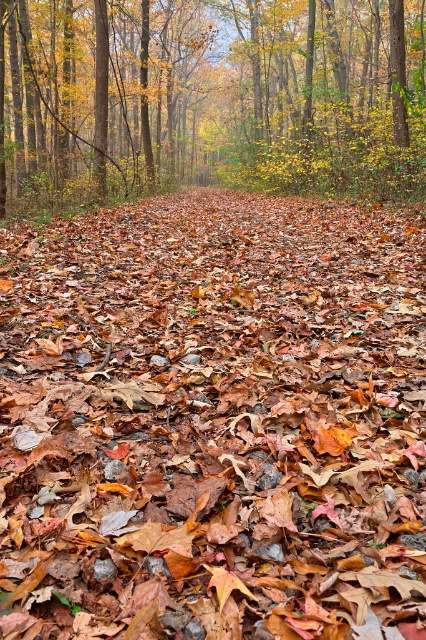
Question: Is the position of brown leaf litter at center less distant than that of yellow-green foliage at center?

Choices:
 (A) no
 (B) yes

Answer: (B)

Question: Can you confirm if brown leaf litter at center is thinner than yellow-green foliage at center?

Choices:
 (A) no
 (B) yes

Answer: (B)

Question: Which of the following is the closest to the observer?

Choices:
 (A) yellow-green foliage at center
 (B) brown leaf litter at center

Answer: (B)

Question: Which point is farther from the camera taking this photo?

Choices:
 (A) (368, 120)
 (B) (317, 320)

Answer: (A)

Question: Is brown leaf litter at center wider than yellow-green foliage at center?

Choices:
 (A) no
 (B) yes

Answer: (A)